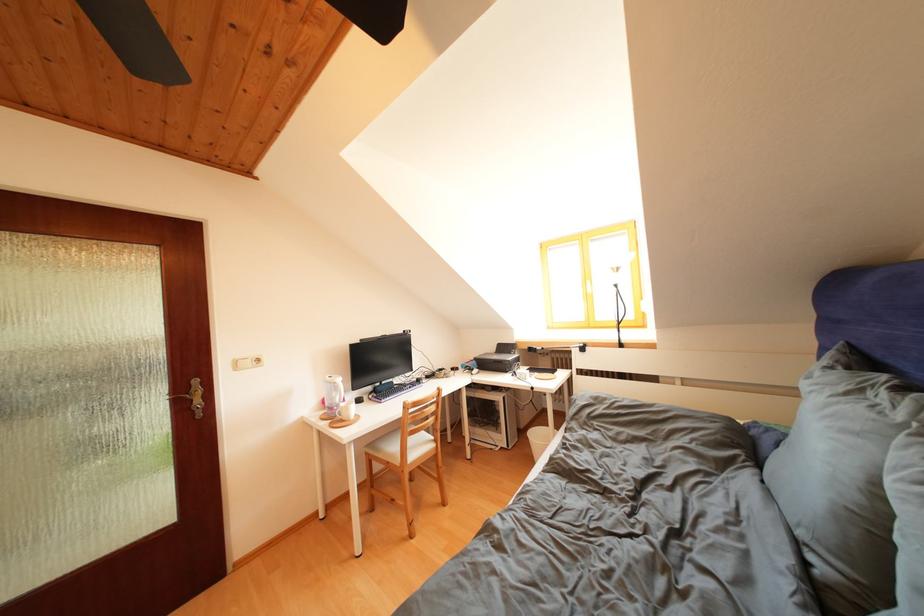
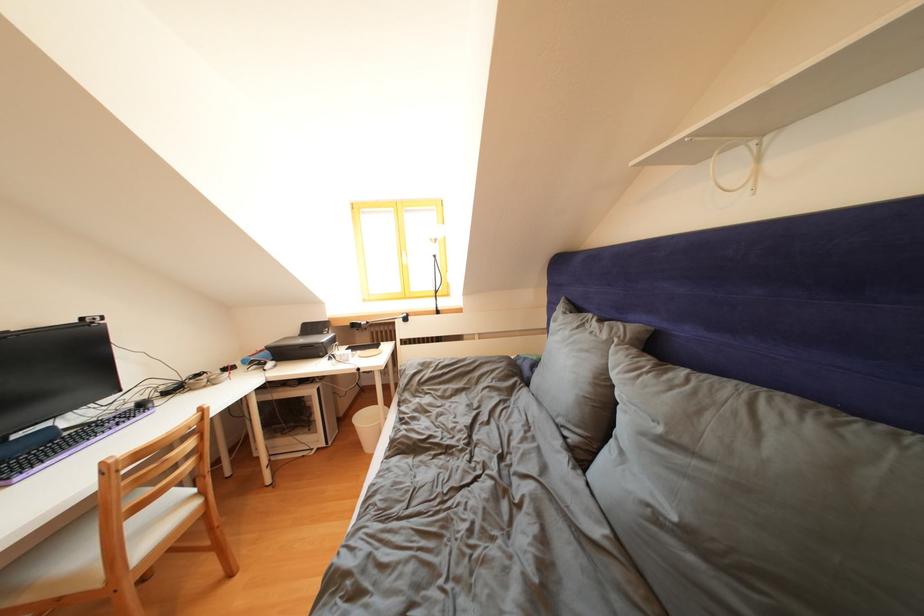
Question: How did the camera likely rotate?

Choices:
 (A) Left
 (B) Right
 (C) Up
 (D) Down

Answer: (B)